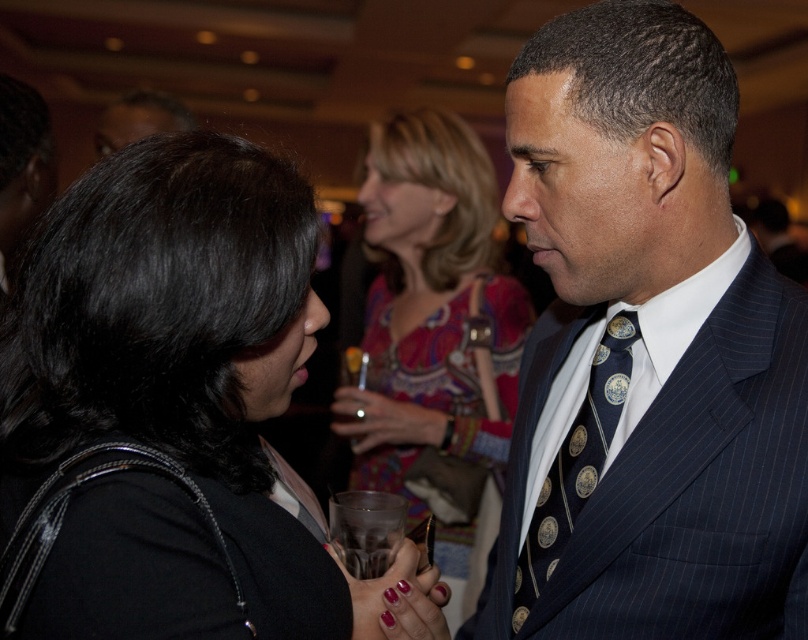
Can you confirm if dark blue pinstripe suit at center is positioned to the right of black fabric at center?

Indeed, dark blue pinstripe suit at center is positioned on the right side of black fabric at center.

Who is more distant from viewer, (674, 257) or (146, 534)?

The point (674, 257) is behind.

Between point (541, 394) and point (129, 417), which one is positioned in front?

Point (129, 417)

At what (x,y) coordinates should I click in order to perform the action: click on dark blue pinstripe suit at center. Please return your answer as a coordinate pair (x, y). The height and width of the screenshot is (640, 808). Looking at the image, I should click on (646, 348).

Can you confirm if printed silk blouse at center is wider than navy blue silk tie at center?

Indeed, printed silk blouse at center has a greater width compared to navy blue silk tie at center.

Is printed silk blouse at center to the left of navy blue silk tie at center from the viewer's perspective?

Indeed, printed silk blouse at center is positioned on the left side of navy blue silk tie at center.

Identify the location of printed silk blouse at center. (436, 333).

Who is higher up, black fabric at center or navy blue silk tie at center?

black fabric at center is higher up.

Is black fabric at center wider than navy blue silk tie at center?

Yes, black fabric at center is wider than navy blue silk tie at center.

Who is more distant from viewer, (80, 376) or (569, 472)?

Point (569, 472)

Identify the location of black fabric at center. (167, 410).